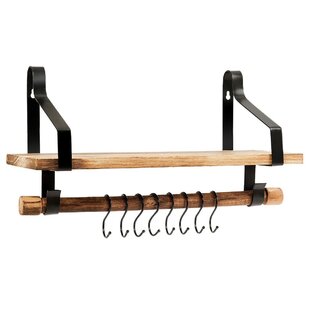
Find the location of a particular element. The width and height of the screenshot is (310, 310). 1 wooden flat shelf is located at coordinates (104, 167).